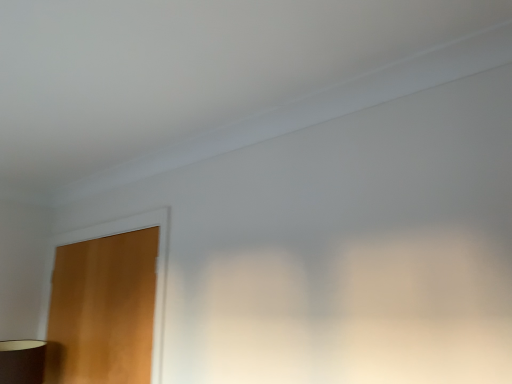
What is the approximate height of matte wooden door at lower left?

32.30 inches.

The width and height of the screenshot is (512, 384). Identify the location of matte wooden door at lower left. (103, 310).

Image resolution: width=512 pixels, height=384 pixels. What do you see at coordinates (103, 310) in the screenshot? I see `matte wooden door at lower left` at bounding box center [103, 310].

Where is `matte wooden door at lower left`? matte wooden door at lower left is located at coordinates (103, 310).